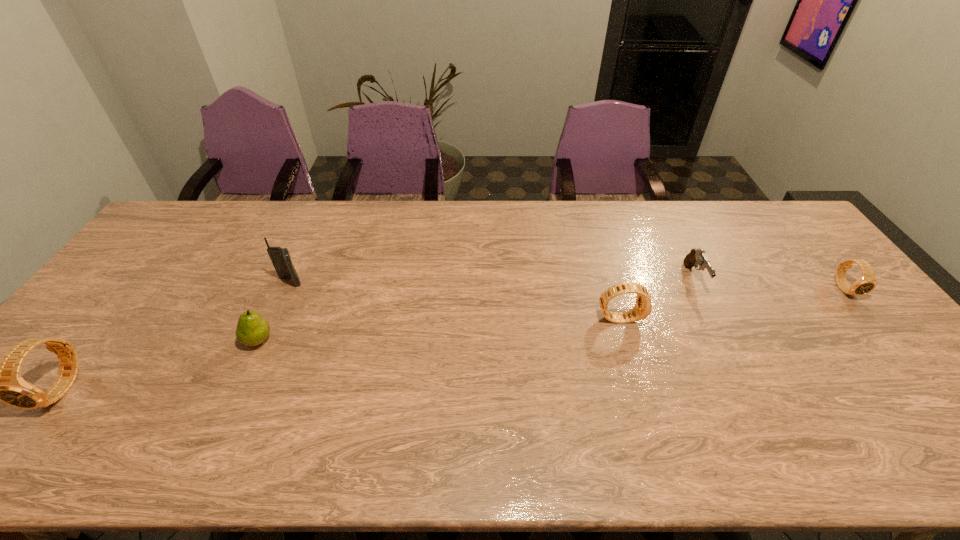
To achieve uniform spacing by inserting another watch among them, please point to a free space for this new watch. Please provide its 2D coordinates. Your answer should be formatted as a tuple, i.e. [(x, y)], where the tuple contains the x and y coordinates of a point satisfying the conditions above.

[(361, 350)]